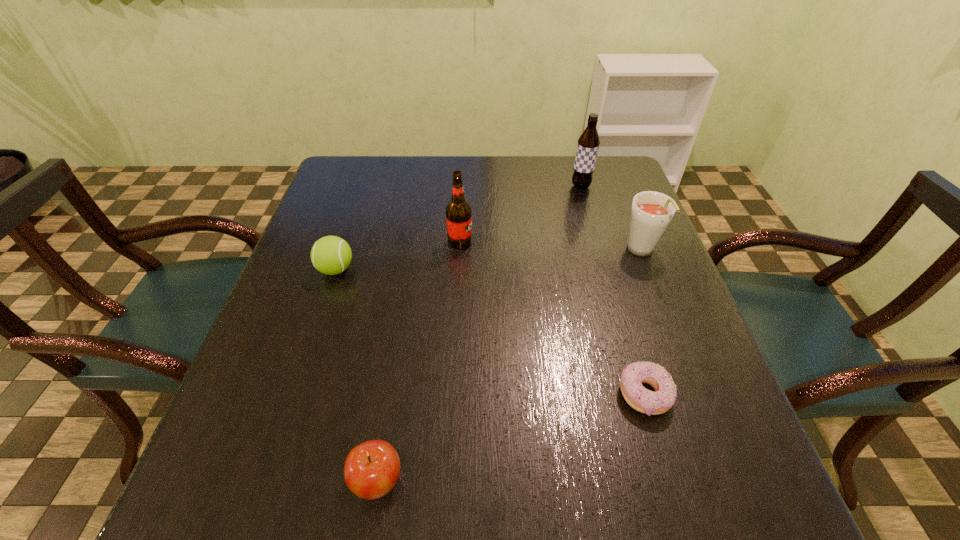
Locate an element on the screen. The image size is (960, 540). the farthest root beer is located at coordinates (588, 144).

Find the location of a particular element. the second root beer from left to right is located at coordinates (588, 144).

I want to click on the leftmost root beer, so click(x=458, y=211).

What are the coordinates of `the rightmost root beer` in the screenshot? It's located at (651, 213).

This screenshot has width=960, height=540. What are the coordinates of `the leftmost object` in the screenshot? It's located at (331, 255).

This screenshot has height=540, width=960. Find the location of `apple`. apple is located at coordinates (372, 468).

At what (x,y) coordinates should I click in order to perform the action: click on the nearest object. Please return your answer as a coordinate pair (x, y). The height and width of the screenshot is (540, 960). Looking at the image, I should click on (372, 468).

Identify the location of the second nearest object. (641, 399).

This screenshot has height=540, width=960. What are the coordinates of `the shortest object` in the screenshot? It's located at (641, 399).

Identify the location of blank space located 0.110m on the back of the farthest object. (573, 161).